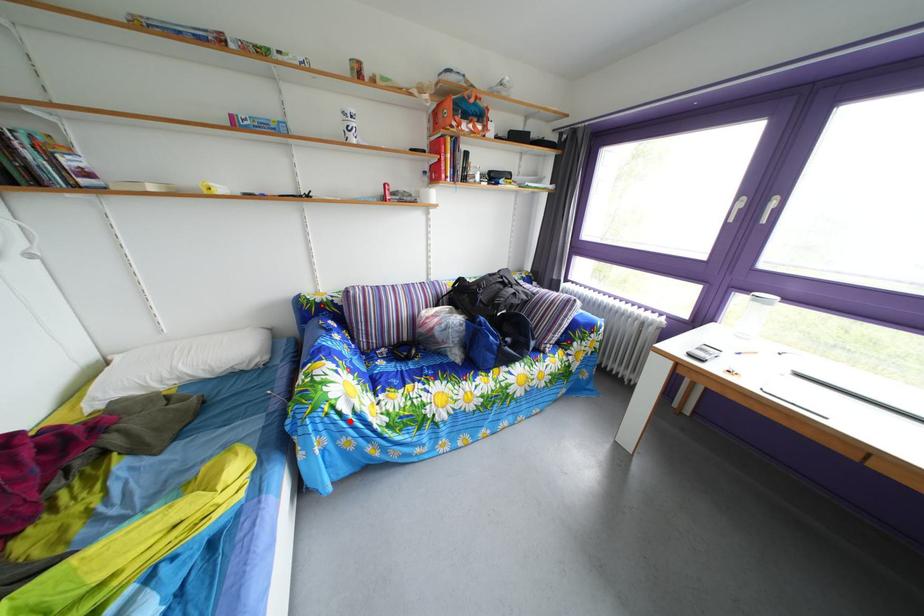
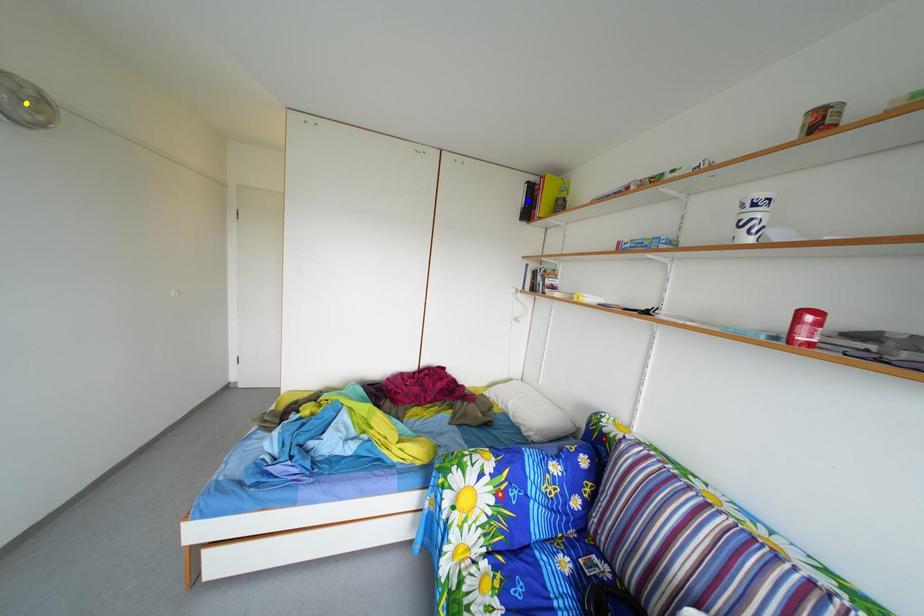
Question: I am providing you with two images of the same scene from different viewpoints. A red point is marked on the first image. You are given multiple points on the second image. Which point in image 2 represents the same 3d spot as the red point in image 1?

Choices:
 (A) yellow point
 (B) blue point
 (C) green point

Answer: (C)